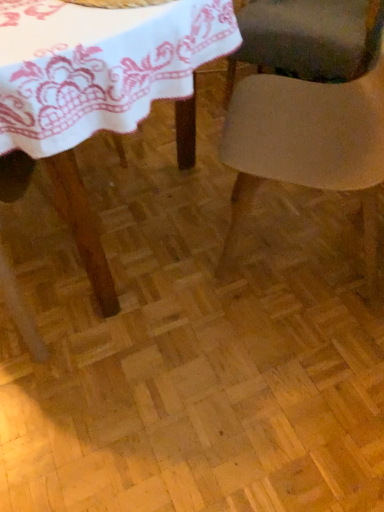
This screenshot has width=384, height=512. Identify the location of free spot to the left of smooth beige chair at center, which appears as the second chair when viewed from the back. (170, 250).